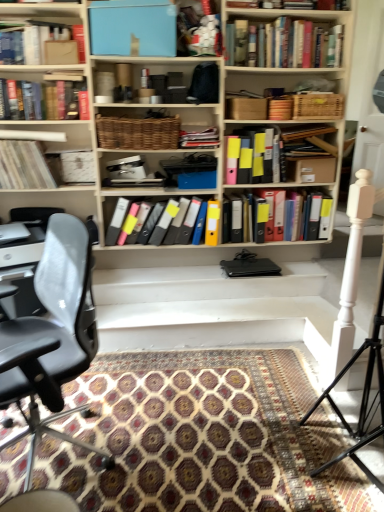
What is the approximate width of blue glossy monitor at upper center, which is the 2th cabinet in bottom-to-top order?

28.90 centimeters.

Where is `patterned carpet at center`? The width and height of the screenshot is (384, 512). patterned carpet at center is located at coordinates (202, 437).

How much space does white matte plastic container at upper center, acting as the second book starting from the top, occupy horizontally?

11.37 inches.

What do you see at coordinates (52, 337) in the screenshot?
I see `black leather chair at left` at bounding box center [52, 337].

The image size is (384, 512). In order to click on black plastic computer desk at left in this screenshot , I will do `click(23, 271)`.

Does black plastic computer desk at left have a greater width compared to white matte tripod at right?

Indeed, black plastic computer desk at left has a greater width compared to white matte tripod at right.

Considering the sizes of objects black plastic computer desk at left and white matte tripod at right in the image provided, who is taller, black plastic computer desk at left or white matte tripod at right?

white matte tripod at right.

Is black plastic computer desk at left directly adjacent to white matte tripod at right?

No, black plastic computer desk at left is not touching white matte tripod at right.

Measure the distance between black plastic computer desk at left and white matte tripod at right.

A distance of 1.74 meters exists between black plastic computer desk at left and white matte tripod at right.

Looking at this image, can you confirm if hardcover book at upper left, the 5th book positioned from the bottom, is smaller than matte black laptop at left?

No.

Who is more distant, hardcover book at upper left, the 5th book positioned from the bottom, or matte black laptop at left?

matte black laptop at left.

In terms of height, does hardcover book at upper left, the 4th book from the top, look taller or shorter compared to matte black laptop at left?

In the image, hardcover book at upper left, the 4th book from the top, appears to be taller than matte black laptop at left.

Where is `chair that is in front of the hardcover book at upper center, which ranks as the 1th book in top-to-bottom order`? chair that is in front of the hardcover book at upper center, which ranks as the 1th book in top-to-bottom order is located at coordinates (52, 337).

Is hardcover book at upper center, acting as the eighth book starting from the bottom, not near black leather chair at left?

hardcover book at upper center, acting as the eighth book starting from the bottom, is far away from black leather chair at left.

Measure the distance between hardcover book at upper center, acting as the eighth book starting from the bottom, and black leather chair at left.

hardcover book at upper center, acting as the eighth book starting from the bottom, and black leather chair at left are 1.99 meters apart from each other.

In terms of height, does hardcover book at upper center, acting as the eighth book starting from the bottom, look taller or shorter compared to black leather chair at left?

In the image, hardcover book at upper center, acting as the eighth book starting from the bottom, appears to be shorter than black leather chair at left.

Can you confirm if hardcover book at upper center, acting as the eighth book starting from the bottom, is taller than hardcover book at upper left, the 4th book from the top?

Yes, hardcover book at upper center, acting as the eighth book starting from the bottom, is taller than hardcover book at upper left, the 4th book from the top.

Does hardcover book at upper center, which ranks as the 1th book in top-to-bottom order, have a lesser width compared to hardcover book at upper left, the 4th book from the top?

No.

Which object is closer to the camera, white matte stairs at center or white matte plastic container at upper center, arranged as the seventh book when ordered from the bottom?

white matte stairs at center is closer to the camera.

Is point (109, 310) positioned in front of point (190, 22)?

No.

From a real-world perspective, relative to white matte plastic container at upper center, acting as the second book starting from the top, is white matte stairs at center vertically above or below?

white matte stairs at center is below white matte plastic container at upper center, acting as the second book starting from the top.

Which of these two, blue glossy monitor at upper center, which is the 2th cabinet in bottom-to-top order, or hardcover book at upper left, the 4th book from the top, is bigger?

blue glossy monitor at upper center, which is the 2th cabinet in bottom-to-top order, is bigger.

There is a blue glossy monitor at upper center, arranged as the 1th cabinet when viewed from the top. Where is `the 4th book below it (from a real-world perspective)`? the 4th book below it (from a real-world perspective) is located at coordinates (x=63, y=95).

From a real-world perspective, relative to hardcover book at upper left, the 5th book positioned from the bottom, is blue glossy monitor at upper center, arranged as the 1th cabinet when viewed from the top, vertically above or below?

In terms of real-world spatial position, blue glossy monitor at upper center, arranged as the 1th cabinet when viewed from the top, is above hardcover book at upper left, the 5th book positioned from the bottom.

Looking at this image, considering the positions of objects matte black folders at center, acting as the 4th book starting from the bottom, and hardcover book at upper center, acting as the eighth book starting from the bottom, in the image provided, who is behind, matte black folders at center, acting as the 4th book starting from the bottom, or hardcover book at upper center, acting as the eighth book starting from the bottom,?

matte black folders at center, acting as the 4th book starting from the bottom, is further from the camera.

From a real-world perspective, which is physically above, matte black folders at center, the fifth book positioned from the top, or hardcover book at upper center, acting as the eighth book starting from the bottom?

hardcover book at upper center, acting as the eighth book starting from the bottom, from a real-world perspective.

Does matte black folders at center, the fifth book positioned from the top, have a larger size compared to hardcover book at upper center, which ranks as the 1th book in top-to-bottom order?

No, matte black folders at center, the fifth book positioned from the top, is not bigger than hardcover book at upper center, which ranks as the 1th book in top-to-bottom order.

How many degrees apart are the facing directions of matte black folders at center, the fifth book positioned from the top, and hardcover book at upper center, which ranks as the 1th book in top-to-bottom order?

0.000621 degrees.

The height and width of the screenshot is (512, 384). What are the coordinates of `tripod above the black plastic computer desk at left (from a real-world perspective)` in the screenshot? It's located at (362, 396).

In order to click on shelf lying behind the hardcover book at upper left, the 4th book from the top in this screenshot , I will do [52, 201].

From the image, which object appears to be farther from multicolored plastic folders at center, the 1th book from the bottom, black leather chair at left or hardcover book at upper center, which ranks as the 1th book in top-to-bottom order?

Based on the image, hardcover book at upper center, which ranks as the 1th book in top-to-bottom order, appears to be further to multicolored plastic folders at center, the 1th book from the bottom.

Looking at the image, which one is located closer to white matte tripod at right, blue glossy monitor at upper center, which is the 2th cabinet in bottom-to-top order, or black leather chair at left?

black leather chair at left.

When comparing their distances from matte white book at upper left, the sixth book from the top, does hardcover book at upper center, acting as the eighth book starting from the bottom, or matte black laptop at left seem further?

Among the two, hardcover book at upper center, acting as the eighth book starting from the bottom, is located further to matte white book at upper left, the sixth book from the top.

Estimate the real-world distances between objects in this image. Which object is further from matte white book at upper left, the sixth book from the top, white matte tripod at right or multicolored plastic binders at center, arranged as the seventh book when viewed from the top?

white matte tripod at right is further to matte white book at upper left, the sixth book from the top.

From the image, which object appears to be nearer to multicolored plastic folders at center, the 8th book positioned from the top, patterned carpet at center or blue glossy monitor at upper center, which is the 2th cabinet in bottom-to-top order?

Among the two, blue glossy monitor at upper center, which is the 2th cabinet in bottom-to-top order, is located nearer to multicolored plastic folders at center, the 8th book positioned from the top.

Looking at this image, estimate the real-world distances between objects in this image. Which object is further from hardcover book at upper left, the 4th book from the top, matte cardboard box at upper left, which is the 6th book from bottom to top, or woven brown basket at center, positioned as the first cabinet in bottom-to-top order?

woven brown basket at center, positioned as the first cabinet in bottom-to-top order, is further to hardcover book at upper left, the 4th book from the top.

Which object lies nearer to the anchor point white matte tripod at right, multicolored plastic folders at center, the 1th book from the bottom, or blue glossy monitor at upper center, which is the 2th cabinet in bottom-to-top order?

multicolored plastic folders at center, the 1th book from the bottom.

From the image, which object appears to be farther from woven brown basket at center, positioned as the 2th cabinet in top-to-bottom order, multicolored plastic folders at center, the 8th book positioned from the top, or matte white book at upper left, the sixth book from the top?

Based on the image, matte white book at upper left, the sixth book from the top, appears to be further to woven brown basket at center, positioned as the 2th cabinet in top-to-bottom order.

This screenshot has width=384, height=512. Identify the location of chair between white matte tripod at right and matte black laptop at left in the front-back direction. point(52,337).

The image size is (384, 512). I want to click on plain between matte black laptop at left and white matte stairs at center, so click(202, 437).

This screenshot has height=512, width=384. Find the location of `stairwell between blue glossy monitor at upper center, arranged as the 1th cabinet when viewed from the top, and patterned carpet at center in the up-down direction`. stairwell between blue glossy monitor at upper center, arranged as the 1th cabinet when viewed from the top, and patterned carpet at center in the up-down direction is located at coordinates (212, 308).

Locate an element on the screen. computer desk located between white matte tripod at right and matte black folders at center, acting as the 4th book starting from the bottom, in the depth direction is located at coordinates (23, 271).